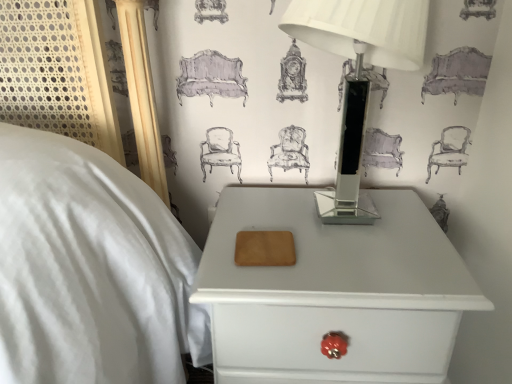
Question: Is point (x=323, y=374) positioned closer to the camera than point (x=354, y=31)?

Choices:
 (A) farther
 (B) closer

Answer: (A)

Question: Considering the positions of white glossy nightstand at lower right and clear glass table lamp at upper right in the image, is white glossy nightstand at lower right taller or shorter than clear glass table lamp at upper right?

Choices:
 (A) tall
 (B) short

Answer: (A)

Question: From the image's perspective, is white glossy nightstand at lower right above or below clear glass table lamp at upper right?

Choices:
 (A) above
 (B) below

Answer: (B)

Question: Based on their positions, is clear glass table lamp at upper right located to the left or right of white glossy nightstand at lower right?

Choices:
 (A) right
 (B) left

Answer: (A)

Question: Considering their positions, is clear glass table lamp at upper right located in front of or behind white glossy nightstand at lower right?

Choices:
 (A) front
 (B) behind

Answer: (A)

Question: Is clear glass table lamp at upper right wider or thinner than white glossy nightstand at lower right?

Choices:
 (A) wide
 (B) thin

Answer: (B)

Question: Considering the positions of clear glass table lamp at upper right and white glossy nightstand at lower right in the image, is clear glass table lamp at upper right bigger or smaller than white glossy nightstand at lower right?

Choices:
 (A) big
 (B) small

Answer: (B)